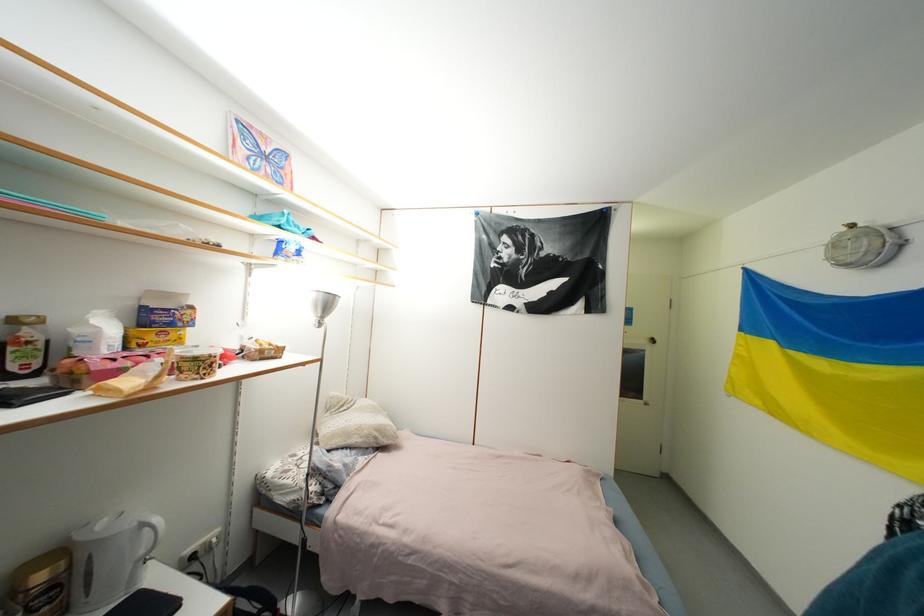
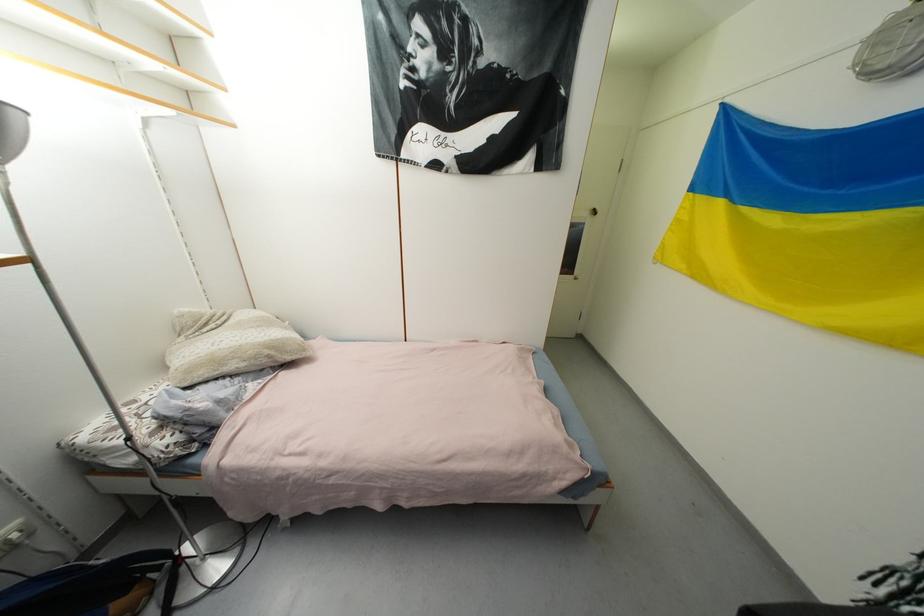
Question: How did the camera likely rotate?

Choices:
 (A) Left
 (B) Right
 (C) Up
 (D) Down

Answer: (D)